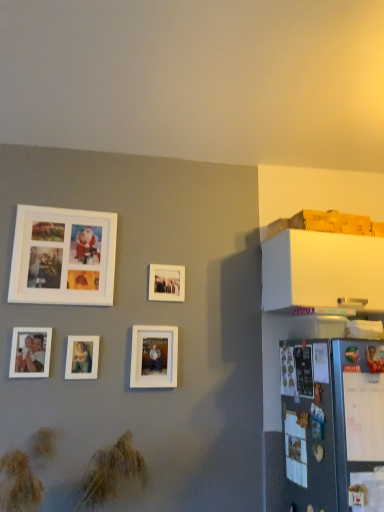
This screenshot has width=384, height=512. What do you see at coordinates (30, 352) in the screenshot?
I see `matte white photo frame at lower left, the 1th picture frame viewed from the left` at bounding box center [30, 352].

The image size is (384, 512). What are the coordinates of `white matte picture frame at center, acting as the 5th picture frame starting from the left` in the screenshot? It's located at (166, 283).

Where is `white matte picture frame at center, the fourth picture frame when ordered from left to right`? The image size is (384, 512). white matte picture frame at center, the fourth picture frame when ordered from left to right is located at coordinates (154, 357).

What do you see at coordinates (63, 257) in the screenshot?
I see `white matte picture frame at upper left, arranged as the 4th picture frame when viewed from the right` at bounding box center [63, 257].

At what (x,y) coordinates should I click in order to perform the action: click on matte white photo frame at lower left, the fifth picture frame from the right. Please return your answer as a coordinate pair (x, y). The width and height of the screenshot is (384, 512). Looking at the image, I should click on (30, 352).

From the picture: Is white matte picture frame at center, the fourth picture frame when ordered from left to right, positioned far away from matte white photo frame at lower left, the fifth picture frame from the right?

No.

Can you confirm if white matte picture frame at center, placed as the 2th picture frame when sorted from right to left, is bigger than matte white photo frame at lower left, the fifth picture frame from the right?

Correct, white matte picture frame at center, placed as the 2th picture frame when sorted from right to left, is larger in size than matte white photo frame at lower left, the fifth picture frame from the right.

Is white matte picture frame at center, placed as the 2th picture frame when sorted from right to left, located outside matte white photo frame at lower left, the fifth picture frame from the right?

Yes, white matte picture frame at center, placed as the 2th picture frame when sorted from right to left, is located beyond the bounds of matte white photo frame at lower left, the fifth picture frame from the right.

Considering the relative sizes of white matte picture frame at center, placed as the 2th picture frame when sorted from right to left, and matte white photo frame at lower left, the 1th picture frame viewed from the left, in the image provided, is white matte picture frame at center, placed as the 2th picture frame when sorted from right to left, taller than matte white photo frame at lower left, the 1th picture frame viewed from the left,?

Yes.

Is white matte picture frame at upper left, arranged as the 4th picture frame when viewed from the right, not close to white matte picture frame at center, placed as the 2th picture frame when sorted from right to left?

white matte picture frame at upper left, arranged as the 4th picture frame when viewed from the right, is near white matte picture frame at center, placed as the 2th picture frame when sorted from right to left, not far away.

Based on the photo, which of these two, white matte picture frame at upper left, which appears as the second picture frame when viewed from the left, or white matte picture frame at center, the fourth picture frame when ordered from left to right, stands taller?

With more height is white matte picture frame at upper left, which appears as the second picture frame when viewed from the left.

Is white matte picture frame at upper left, which appears as the second picture frame when viewed from the left, oriented towards white matte picture frame at center, placed as the 2th picture frame when sorted from right to left?

No, white matte picture frame at upper left, which appears as the second picture frame when viewed from the left, is not facing towards white matte picture frame at center, placed as the 2th picture frame when sorted from right to left.

From the image's perspective, is white matte picture frame at upper left, arranged as the 4th picture frame when viewed from the right, located above white matte picture frame at center, the fourth picture frame when ordered from left to right?

Yes, from the image's perspective, white matte picture frame at upper left, arranged as the 4th picture frame when viewed from the right, is on top of white matte picture frame at center, the fourth picture frame when ordered from left to right.

Is white matte picture frame at center, acting as the 5th picture frame starting from the left, bigger or smaller than white matte picture frame at center, the fourth picture frame when ordered from left to right?

In the image, white matte picture frame at center, acting as the 5th picture frame starting from the left, appears to be smaller than white matte picture frame at center, the fourth picture frame when ordered from left to right.

Considering the relative sizes of white matte picture frame at center, which is counted as the 1th picture frame, starting from the right, and white matte picture frame at center, placed as the 2th picture frame when sorted from right to left, in the image provided, is white matte picture frame at center, which is counted as the 1th picture frame, starting from the right, wider than white matte picture frame at center, placed as the 2th picture frame when sorted from right to left,?

Yes, white matte picture frame at center, which is counted as the 1th picture frame, starting from the right, is wider than white matte picture frame at center, placed as the 2th picture frame when sorted from right to left.

From a real-world perspective, who is located lower, white matte picture frame at center, which is counted as the 1th picture frame, starting from the right, or white matte picture frame at center, placed as the 2th picture frame when sorted from right to left?

white matte picture frame at center, placed as the 2th picture frame when sorted from right to left.

From the image's perspective, is white matte picture frame at center, which is counted as the 1th picture frame, starting from the right, above or below white matte picture frame at center, placed as the 2th picture frame when sorted from right to left?

white matte picture frame at center, which is counted as the 1th picture frame, starting from the right, is above white matte picture frame at center, placed as the 2th picture frame when sorted from right to left.

Is matte white photo frame at lower left, the 1th picture frame viewed from the left, surrounding matte white picture frame at center, the third picture frame from the left?

Definitely not — matte white picture frame at center, the third picture frame from the left, is not inside matte white photo frame at lower left, the 1th picture frame viewed from the left.

From the image's perspective, who appears lower, matte white photo frame at lower left, the 1th picture frame viewed from the left, or matte white picture frame at center, the third picture frame from the left?

matte white picture frame at center, the third picture frame from the left, is shown below in the image.

From the image's perspective, count 1st picture frames upward from the matte white picture frame at center, marked as the third picture frame in a right-to-left arrangement, and point to it. Please provide its 2D coordinates.

[(30, 352)]

Is matte white photo frame at lower left, the 1th picture frame viewed from the left, to the right of matte white picture frame at center, the third picture frame from the left, from the viewer's perspective?

Incorrect, matte white photo frame at lower left, the 1th picture frame viewed from the left, is not on the right side of matte white picture frame at center, the third picture frame from the left.

Is matte white picture frame at center, the third picture frame from the left, in front of or behind white matte picture frame at center, placed as the 2th picture frame when sorted from right to left, in the image?

matte white picture frame at center, the third picture frame from the left, is positioned closer to the viewer than white matte picture frame at center, placed as the 2th picture frame when sorted from right to left.

Is matte white picture frame at center, marked as the third picture frame in a right-to-left arrangement, with white matte picture frame at center, placed as the 2th picture frame when sorted from right to left?

No, matte white picture frame at center, marked as the third picture frame in a right-to-left arrangement, is not touching white matte picture frame at center, placed as the 2th picture frame when sorted from right to left.

Is point (96, 372) farther from viewer compared to point (156, 354)?

No, (96, 372) is closer to viewer.

Considering the sizes of objects matte white picture frame at center, the third picture frame from the left, and white matte picture frame at center, placed as the 2th picture frame when sorted from right to left, in the image provided, who is bigger, matte white picture frame at center, the third picture frame from the left, or white matte picture frame at center, placed as the 2th picture frame when sorted from right to left,?

With larger size is white matte picture frame at center, placed as the 2th picture frame when sorted from right to left.

From a real-world perspective, is white matte picture frame at center, which is counted as the 1th picture frame, starting from the right, over white matte picture frame at upper left, which appears as the second picture frame when viewed from the left?

Incorrect, from a real-world perspective, white matte picture frame at center, which is counted as the 1th picture frame, starting from the right, is lower than white matte picture frame at upper left, which appears as the second picture frame when viewed from the left.

From the image's perspective, is white matte picture frame at center, which is counted as the 1th picture frame, starting from the right, below white matte picture frame at upper left, arranged as the 4th picture frame when viewed from the right?

Yes, from the image's perspective, white matte picture frame at center, which is counted as the 1th picture frame, starting from the right, is beneath white matte picture frame at upper left, arranged as the 4th picture frame when viewed from the right.

Measure the distance from white matte picture frame at center, which is counted as the 1th picture frame, starting from the right, to white matte picture frame at upper left, arranged as the 4th picture frame when viewed from the right.

white matte picture frame at center, which is counted as the 1th picture frame, starting from the right, is 15.65 inches away from white matte picture frame at upper left, arranged as the 4th picture frame when viewed from the right.

This screenshot has height=512, width=384. Find the location of `picture frame that is the 1st object located below the white matte picture frame at upper left, which appears as the second picture frame when viewed from the left (from the image's perspective)`. picture frame that is the 1st object located below the white matte picture frame at upper left, which appears as the second picture frame when viewed from the left (from the image's perspective) is located at coordinates (166, 283).

Can you confirm if matte white picture frame at center, marked as the third picture frame in a right-to-left arrangement, is shorter than matte white photo frame at lower left, the 1th picture frame viewed from the left?

Yes.

Which of these two, matte white picture frame at center, the third picture frame from the left, or matte white photo frame at lower left, the fifth picture frame from the right, is wider?

matte white photo frame at lower left, the fifth picture frame from the right, is wider.

Which of these two, matte white picture frame at center, marked as the third picture frame in a right-to-left arrangement, or matte white photo frame at lower left, the fifth picture frame from the right, is smaller?

Smaller between the two is matte white picture frame at center, marked as the third picture frame in a right-to-left arrangement.

Looking at this image, is matte white picture frame at center, the third picture frame from the left, turned away from matte white photo frame at lower left, the fifth picture frame from the right?

Answer: No, matte white photo frame at lower left, the fifth picture frame from the right, is not at the back of matte white picture frame at center, the third picture frame from the left.

Find the location of a particular element. Image resolution: width=384 pixels, height=512 pixels. the 2nd picture frame above the white matte picture frame at center, the fourth picture frame when ordered from left to right (from the image's perspective) is located at coordinates (30, 352).

From the white matte picture frame at upper left, which appears as the second picture frame when viewed from the left, count 2nd picture frames backward and point to it. Please provide its 2D coordinates.

[(154, 357)]

When comparing their distances from matte white photo frame at lower left, the fifth picture frame from the right, does matte white picture frame at center, marked as the third picture frame in a right-to-left arrangement, or white matte picture frame at center, which is counted as the 1th picture frame, starting from the right, seem further?

The object further to matte white photo frame at lower left, the fifth picture frame from the right, is white matte picture frame at center, which is counted as the 1th picture frame, starting from the right.

Estimate the real-world distances between objects in this image. Which object is closer to matte white picture frame at center, the third picture frame from the left, white matte picture frame at center, placed as the 2th picture frame when sorted from right to left, or white matte picture frame at center, acting as the 5th picture frame starting from the left?

white matte picture frame at center, placed as the 2th picture frame when sorted from right to left, is positioned closer to the anchor matte white picture frame at center, the third picture frame from the left.

Looking at the image, which one is located further to matte white picture frame at center, marked as the third picture frame in a right-to-left arrangement, white matte picture frame at center, acting as the 5th picture frame starting from the left, or white matte picture frame at upper left, arranged as the 4th picture frame when viewed from the right?

white matte picture frame at center, acting as the 5th picture frame starting from the left.

When comparing their distances from white matte picture frame at upper left, which appears as the second picture frame when viewed from the left, does white matte picture frame at center, placed as the 2th picture frame when sorted from right to left, or matte white picture frame at center, marked as the third picture frame in a right-to-left arrangement, seem further?

The object further to white matte picture frame at upper left, which appears as the second picture frame when viewed from the left, is white matte picture frame at center, placed as the 2th picture frame when sorted from right to left.

Estimate the real-world distances between objects in this image. Which object is further from white matte picture frame at upper left, arranged as the 4th picture frame when viewed from the right, matte white picture frame at center, marked as the third picture frame in a right-to-left arrangement, or matte white photo frame at lower left, the fifth picture frame from the right?

Among the two, matte white picture frame at center, marked as the third picture frame in a right-to-left arrangement, is located further to white matte picture frame at upper left, arranged as the 4th picture frame when viewed from the right.

Estimate the real-world distances between objects in this image. Which object is further from matte white picture frame at center, marked as the third picture frame in a right-to-left arrangement, white matte picture frame at center, acting as the 5th picture frame starting from the left, or white matte picture frame at center, placed as the 2th picture frame when sorted from right to left?

Among the two, white matte picture frame at center, acting as the 5th picture frame starting from the left, is located further to matte white picture frame at center, marked as the third picture frame in a right-to-left arrangement.

Looking at this image, when comparing their distances from matte white picture frame at center, the third picture frame from the left, does white matte picture frame at center, which is counted as the 1th picture frame, starting from the right, or matte white photo frame at lower left, the fifth picture frame from the right, seem further?

The object further to matte white picture frame at center, the third picture frame from the left, is white matte picture frame at center, which is counted as the 1th picture frame, starting from the right.

Estimate the real-world distances between objects in this image. Which object is further from matte white photo frame at lower left, the fifth picture frame from the right, white matte picture frame at upper left, arranged as the 4th picture frame when viewed from the right, or white matte picture frame at center, acting as the 5th picture frame starting from the left?

Among the two, white matte picture frame at center, acting as the 5th picture frame starting from the left, is located further to matte white photo frame at lower left, the fifth picture frame from the right.

Where is `picture frame located between matte white picture frame at center, marked as the third picture frame in a right-to-left arrangement, and white matte picture frame at center, which is counted as the 1th picture frame, starting from the right, in the left-right direction`? Image resolution: width=384 pixels, height=512 pixels. picture frame located between matte white picture frame at center, marked as the third picture frame in a right-to-left arrangement, and white matte picture frame at center, which is counted as the 1th picture frame, starting from the right, in the left-right direction is located at coordinates (154, 357).